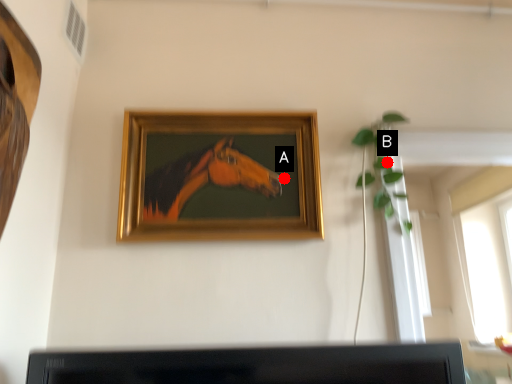
Question: Two points are circled on the image, labeled by A and B beside each circle. Which point is farther from the camera taking this photo?

Choices:
 (A) A is further
 (B) B is further

Answer: (B)